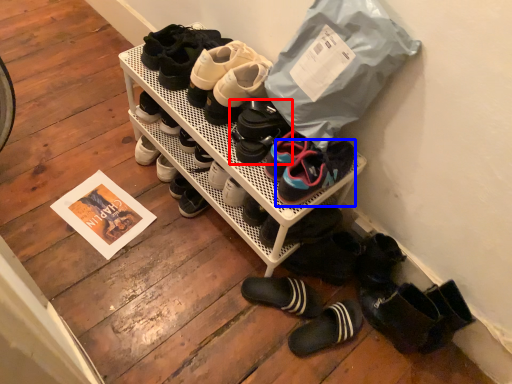
Question: Which of the following is the closest to the observer, footwear (highlighted by a red box) or footwear (highlighted by a blue box)?

Choices:
 (A) footwear
 (B) footwear

Answer: (B)